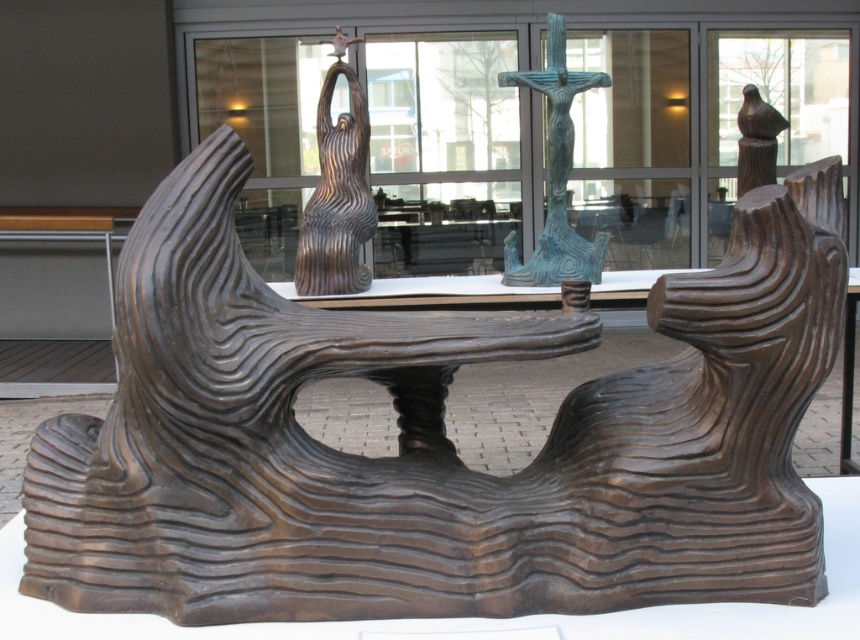
You are an art student analyzing the sculpture. You notice two central elements, the wooden sculpture at center and the green patina metal crucifix at center. Which one is positioned more to the left?

The wooden sculpture at center is positioned more to the left than the green patina metal crucifix at center.

You are an art curator planning to move the wooden sculpture at center and the green patina metal crucifix at center to a new gallery. The doorway has a width limit of 1 meter. Which sculpture should be moved first to ensure it fits through the doorway?

The wooden sculpture at center is thinner than the green patina metal crucifix at center, so the wooden sculpture at center should be moved first to ensure it fits through the doorway.

You are an art student analyzing the sculpture. The wooden sculpture at center and the green patina metal crucifix at center are both central elements. Which one is taller?

The wooden sculpture at center is taller than the green patina metal crucifix at center.